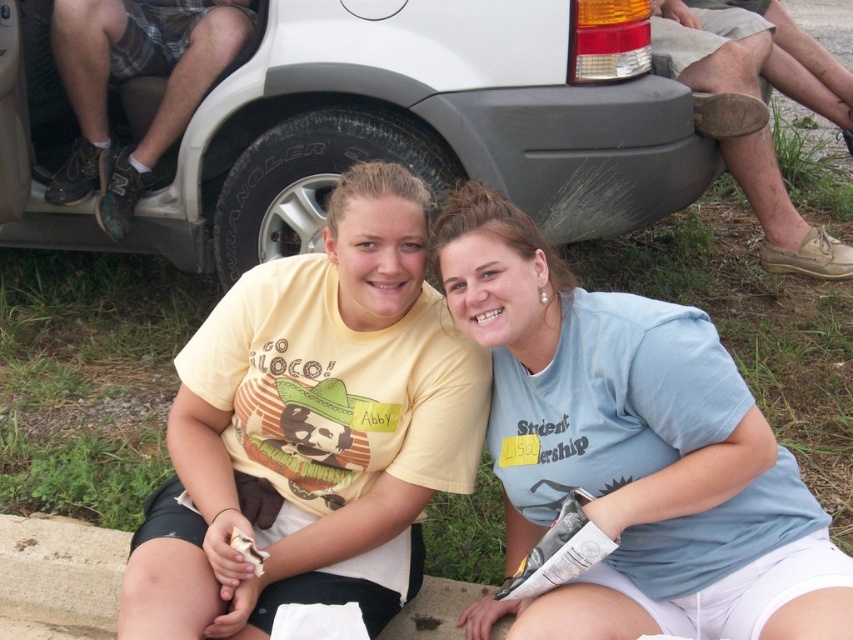
Consider the image. What are the coordinates of the black rubber tire at center?

The black rubber tire at center is located at coordinates 0.283 in the x direction and 0.366 in the y direction.

You are standing in a parking lot and see the black rubber tire at center and the brown leather shoe at lower right. Which object is smaller in size?

The black rubber tire at center is smaller in size compared to the brown leather shoe at lower right.

You are standing at the back of the image and want to pick up the brown leather shoe at lower right. Is the black rubber tire at center blocking your path?

The black rubber tire at center is in front of the brown leather shoe at lower right, so it is blocking your path to the brown leather shoe at lower right.